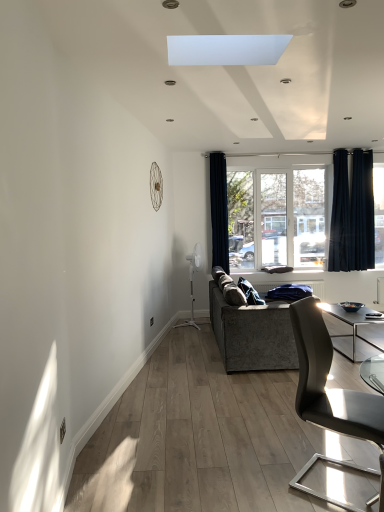
Question: Would you say black velvet curtain at right, arranged as the first curtain when viewed from the right, is outside blue fabric at center?

Choices:
 (A) yes
 (B) no

Answer: (A)

Question: Is black velvet curtain at right, arranged as the first curtain when viewed from the right, positioned in front of blue fabric at center?

Choices:
 (A) no
 (B) yes

Answer: (A)

Question: From a real-world perspective, is black velvet curtain at right, the 3th curtain positioned from the left, under blue fabric at center?

Choices:
 (A) no
 (B) yes

Answer: (A)

Question: Considering the relative sizes of black velvet curtain at right, the 3th curtain positioned from the left, and blue fabric at center in the image provided, is black velvet curtain at right, the 3th curtain positioned from the left, smaller than blue fabric at center?

Choices:
 (A) yes
 (B) no

Answer: (B)

Question: Does black velvet curtain at right, the 3th curtain positioned from the left, have a greater height compared to blue fabric at center?

Choices:
 (A) yes
 (B) no

Answer: (A)

Question: Is black velvet curtain at right, arranged as the first curtain when viewed from the right, placed right next to blue fabric at center?

Choices:
 (A) yes
 (B) no

Answer: (B)

Question: Is blue fabric at center far from dark blue fabric curtain at center, which is counted as the third curtain, starting from the right?

Choices:
 (A) no
 (B) yes

Answer: (B)

Question: Can you confirm if blue fabric at center is positioned to the right of dark blue fabric curtain at center, which is counted as the third curtain, starting from the right?

Choices:
 (A) yes
 (B) no

Answer: (A)

Question: Could you tell me if blue fabric at center is turned towards dark blue fabric curtain at center, which is counted as the third curtain, starting from the right?

Choices:
 (A) yes
 (B) no

Answer: (B)

Question: Considering the relative positions of blue fabric at center and dark blue fabric curtain at center, which is counted as the third curtain, starting from the right, in the image provided, is blue fabric at center to the left of dark blue fabric curtain at center, which is counted as the third curtain, starting from the right, from the viewer's perspective?

Choices:
 (A) no
 (B) yes

Answer: (A)

Question: From the image's perspective, does blue fabric at center appear lower than dark blue fabric curtain at center, marked as the 1th curtain in a left-to-right arrangement?

Choices:
 (A) no
 (B) yes

Answer: (B)

Question: Is blue fabric at center outside dark blue fabric curtain at center, marked as the 1th curtain in a left-to-right arrangement?

Choices:
 (A) no
 (B) yes

Answer: (B)

Question: Is black velvet curtain at right, the 3th curtain positioned from the left, in front of matte black chair at lower right?

Choices:
 (A) yes
 (B) no

Answer: (B)